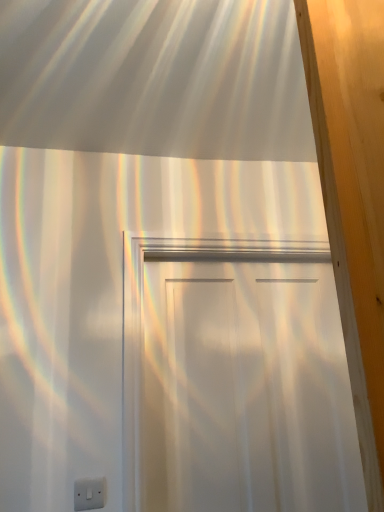
Question: Should I look upward or downward to see white matte door at center?

Choices:
 (A) down
 (B) up

Answer: (A)

Question: Can you confirm if white matte door at center is smaller than white plastic electric outlet at lower left?

Choices:
 (A) yes
 (B) no

Answer: (B)

Question: Does white matte door at center lie in front of white plastic electric outlet at lower left?

Choices:
 (A) yes
 (B) no

Answer: (B)

Question: Can you confirm if white matte door at center is thinner than white plastic electric outlet at lower left?

Choices:
 (A) yes
 (B) no

Answer: (B)

Question: Is white matte door at center not inside white plastic electric outlet at lower left?

Choices:
 (A) no
 (B) yes

Answer: (B)

Question: Are white matte door at center and white plastic electric outlet at lower left making contact?

Choices:
 (A) yes
 (B) no

Answer: (B)

Question: From the image's perspective, does white matte door at center appear lower than white plastic electric outlet at lower left?

Choices:
 (A) no
 (B) yes

Answer: (A)

Question: From the image's perspective, is white plastic electric outlet at lower left over white matte door at center?

Choices:
 (A) no
 (B) yes

Answer: (A)

Question: Is white plastic electric outlet at lower left with white matte door at center?

Choices:
 (A) yes
 (B) no

Answer: (B)

Question: Considering the relative positions of white plastic electric outlet at lower left and white matte door at center in the image provided, is white plastic electric outlet at lower left to the left of white matte door at center from the viewer's perspective?

Choices:
 (A) yes
 (B) no

Answer: (A)

Question: Does white plastic electric outlet at lower left have a lesser height compared to white matte door at center?

Choices:
 (A) no
 (B) yes

Answer: (B)

Question: Is white plastic electric outlet at lower left far away from white matte door at center?

Choices:
 (A) yes
 (B) no

Answer: (B)

Question: Is white plastic electric outlet at lower left in front of white matte door at center?

Choices:
 (A) no
 (B) yes

Answer: (B)

Question: From the image's perspective, is white plastic electric outlet at lower left above or below white matte door at center?

Choices:
 (A) below
 (B) above

Answer: (A)